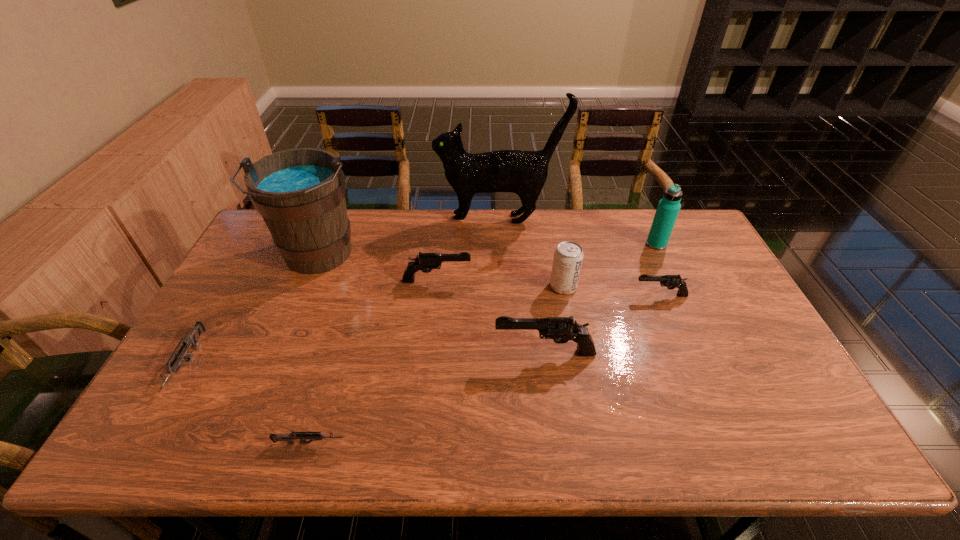
Where is `vacant region between the third tallest object and the soda can`? The height and width of the screenshot is (540, 960). vacant region between the third tallest object and the soda can is located at coordinates (610, 265).

At what (x,y) coordinates should I click in order to perform the action: click on free space between the seventh shortest object and the farthest object. Please return your answer as a coordinate pair (x, y). This screenshot has height=540, width=960. Looking at the image, I should click on (578, 232).

Locate an element on the screen. This screenshot has width=960, height=540. empty space that is in between the soda can and the bigger grey gun is located at coordinates (375, 325).

The height and width of the screenshot is (540, 960). In order to click on vacant area that lies between the second smallest black gun and the soda can in this screenshot , I will do `click(500, 284)`.

You are a GUI agent. You are given a task and a screenshot of the screen. Output one action in this format:
    pyautogui.click(x=<x>, y=<y>)
    Task: Click on the unoccupied area between the nearest black gun and the seventh shortest object
    
    Given the screenshot: What is the action you would take?
    pyautogui.click(x=601, y=299)

Where is `object that is the closest to the seventh tallest object`? The height and width of the screenshot is (540, 960). object that is the closest to the seventh tallest object is located at coordinates (568, 257).

Identify which object is the eighth nearest to the tallest gun. Please provide its 2D coordinates. Your answer should be formatted as a tuple, i.e. [(x, y)], where the tuple contains the x and y coordinates of a point satisfying the conditions above.

[(192, 340)]

Locate which gun is the second closest to the second gun from left to right. Please provide its 2D coordinates. Your answer should be formatted as a tuple, i.e. [(x, y)], where the tuple contains the x and y coordinates of a point satisfying the conditions above.

[(561, 329)]

Identify which gun is the second closest to the second farthest black gun. Please provide its 2D coordinates. Your answer should be formatted as a tuple, i.e. [(x, y)], where the tuple contains the x and y coordinates of a point satisfying the conditions above.

[(424, 261)]

Identify which black gun is the nearest to the third shortest gun. Please provide its 2D coordinates. Your answer should be formatted as a tuple, i.e. [(x, y)], where the tuple contains the x and y coordinates of a point satisfying the conditions above.

[(561, 329)]